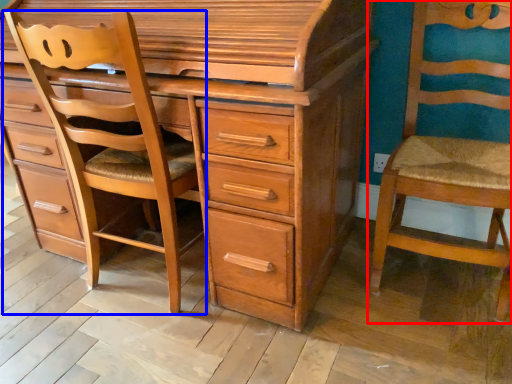
Question: Which object appears farthest to the camera in this image, chair (highlighted by a red box) or furniture (highlighted by a blue box)?

Choices:
 (A) chair
 (B) furniture

Answer: (B)